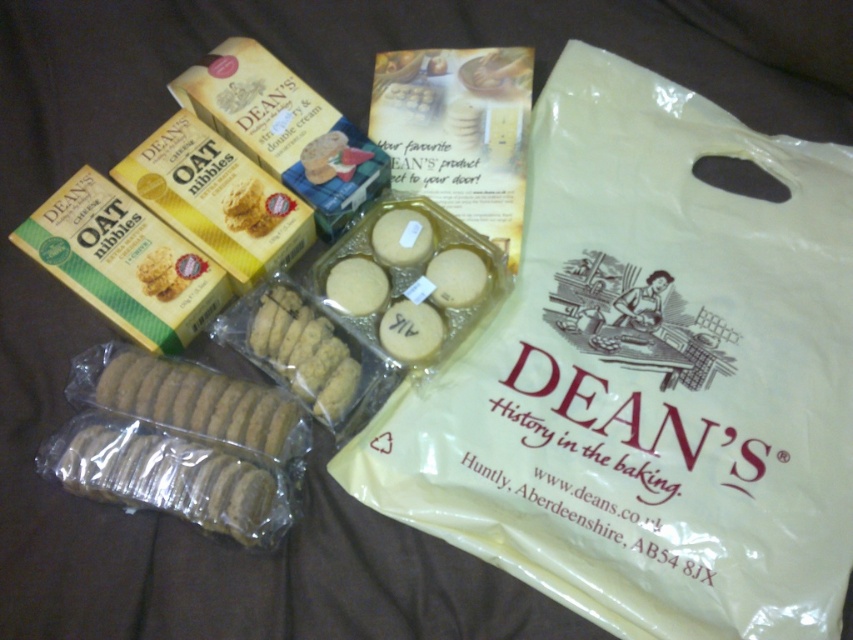
Does matte plastic cheese at center have a greater width compared to brown matte cookie at center?

Yes, matte plastic cheese at center is wider than brown matte cookie at center.

How much distance is there between matte plastic cheese at center and brown matte cookie at center?

4.79 inches

Who is more forward, [376,246] or [329,410]?

Point [329,410] is more forward.

What are the coordinates of `matte plastic cheese at center` in the screenshot? It's located at (410, 278).

From the picture: Can you confirm if beige plastic bag at upper right is positioned below matte plastic cheese at center?

Indeed, beige plastic bag at upper right is positioned under matte plastic cheese at center.

Who is lower down, beige plastic bag at upper right or matte plastic cheese at center?

beige plastic bag at upper right

Identify the location of beige plastic bag at upper right. (648, 378).

Locate an element on the screen. Image resolution: width=853 pixels, height=640 pixels. beige plastic bag at upper right is located at coordinates (648, 378).

Does translucent plastic cookies at lower left have a lesser height compared to brown matte cookie at center?

Yes, translucent plastic cookies at lower left is shorter than brown matte cookie at center.

Which is in front, point (265, 509) or point (302, 369)?

Point (265, 509) is in front.

Find the location of a particular element. The height and width of the screenshot is (640, 853). translucent plastic cookies at lower left is located at coordinates (167, 477).